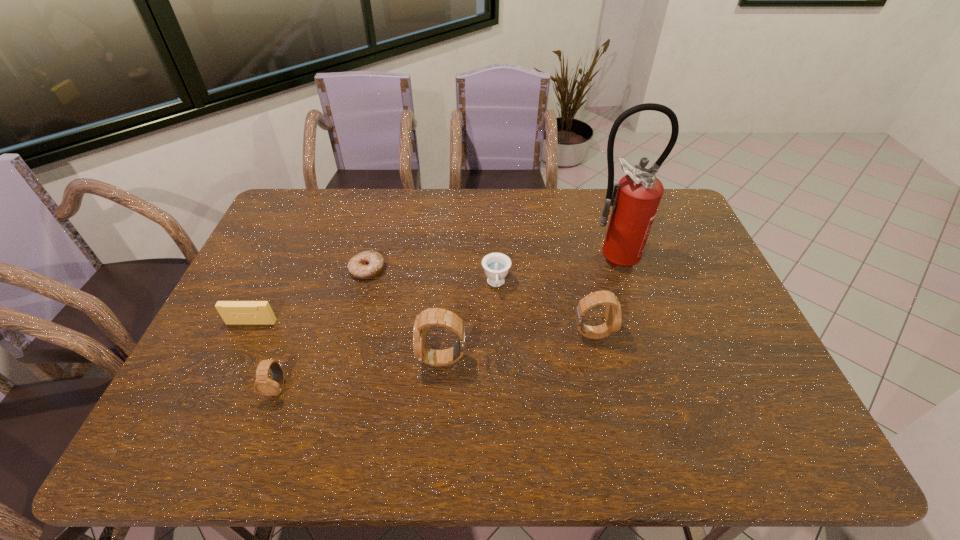
The watchs are evenly distributed in the image. To maintain this, where would you place another watch on the right? Please point to a free space. Please provide its 2D coordinates. Your answer should be formatted as a tuple, i.e. [(x, y)], where the tuple contains the x and y coordinates of a point satisfying the conditions above.

[(727, 310)]